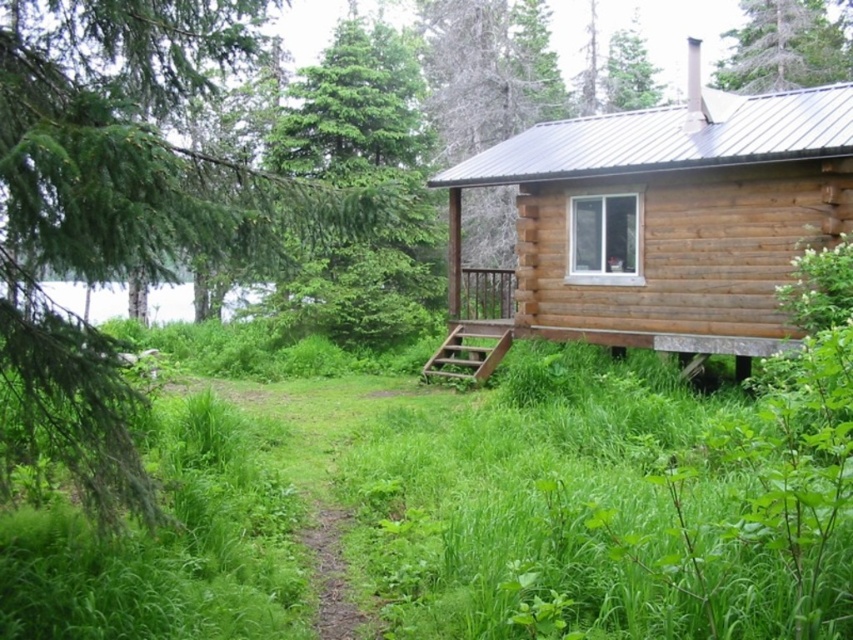
You are standing at the point labeled point (405, 275) and want to reach the cabin. The cabin is located at the other point. If your maximum walking distance is 10 meters, will you be able to reach the cabin?

The distance between point (405, 275) and the cabin is 11.65 meters, which exceeds your maximum walking distance of 10 meters. Therefore, you will not be able to reach the cabin.

You are planning to build a treehouse and need to choose between the green leafy tree at upper left and the green textured tree at upper center. Based on their sizes, which tree would be more suitable for supporting a treehouse?

The green textured tree at upper center is larger than the green leafy tree at upper left, making it more suitable for supporting a treehouse.